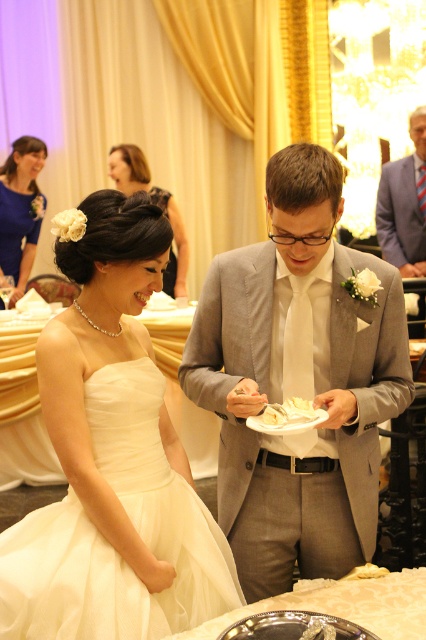
Between gray fabric suit at center and satin black dress at upper left, which one appears on the left side from the viewer's perspective?

From the viewer's perspective, satin black dress at upper left appears more on the left side.

Does point (244, 248) come closer to viewer compared to point (118, 161)?

That is True.

At what (x,y) coordinates should I click in order to perform the action: click on gray fabric suit at center. Please return your answer as a coordinate pair (x, y). Looking at the image, I should click on (296, 381).

Which is behind, point (106, 579) or point (143, 176)?

Positioned behind is point (143, 176).

Looking at this image, is white satin dress at left taller than satin black dress at upper left?

Correct, white satin dress at left is much taller as satin black dress at upper left.

At what (x,y) coordinates should I click in order to perform the action: click on white satin dress at left. Please return your answer as a coordinate pair (x, y). The height and width of the screenshot is (640, 426). Looking at the image, I should click on (112, 456).

Image resolution: width=426 pixels, height=640 pixels. I want to click on white satin dress at left, so click(112, 456).

Who is positioned more to the left, satin black dress at upper left or white paper napkin at center?

Positioned to the left is satin black dress at upper left.

Does satin black dress at upper left have a greater width compared to white paper napkin at center?

Yes.

Where is `satin black dress at upper left`? The height and width of the screenshot is (640, 426). satin black dress at upper left is located at coordinates (155, 204).

Where is `satin black dress at upper left`? satin black dress at upper left is located at coordinates (155, 204).